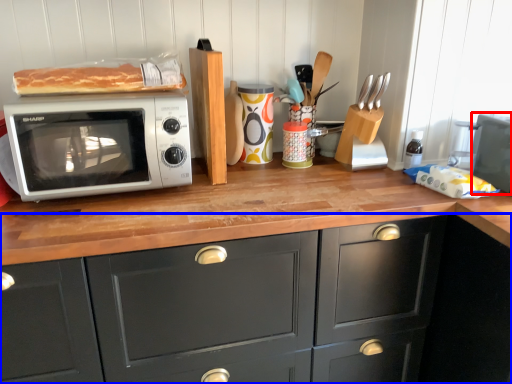
Question: Among these objects, which one is nearest to the camera, appliance (highlighted by a red box) or cabinetry (highlighted by a blue box)?

Choices:
 (A) appliance
 (B) cabinetry

Answer: (B)